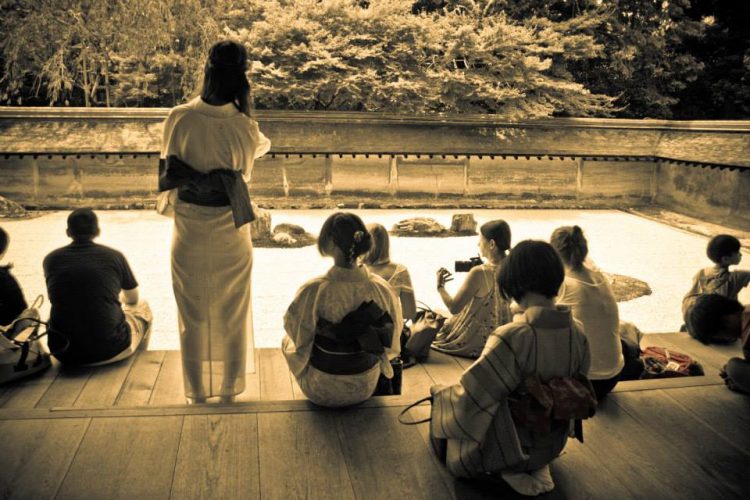
Find the location of a particular element. The width and height of the screenshot is (750, 500). phone is located at coordinates tap(463, 263).